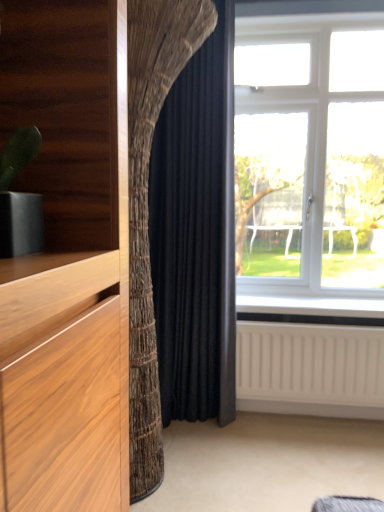
Question: Does black velvet curtain at center come in front of white plastic window at right?

Choices:
 (A) no
 (B) yes

Answer: (B)

Question: Considering the relative sizes of black velvet curtain at center and white plastic window at right in the image provided, is black velvet curtain at center taller than white plastic window at right?

Choices:
 (A) no
 (B) yes

Answer: (B)

Question: Is black velvet curtain at center further to the viewer compared to white plastic window at right?

Choices:
 (A) yes
 (B) no

Answer: (B)

Question: From a real-world perspective, is black velvet curtain at center positioned over white plastic window at right based on gravity?

Choices:
 (A) no
 (B) yes

Answer: (A)

Question: Does black velvet curtain at center appear on the right side of white plastic window at right?

Choices:
 (A) yes
 (B) no

Answer: (B)

Question: Is black velvet curtain at center bigger or smaller than white textured radiator at lower right?

Choices:
 (A) big
 (B) small

Answer: (A)

Question: Based on their positions, is black velvet curtain at center located to the left or right of white textured radiator at lower right?

Choices:
 (A) left
 (B) right

Answer: (A)

Question: Looking at their shapes, would you say black velvet curtain at center is wider or thinner than white textured radiator at lower right?

Choices:
 (A) wide
 (B) thin

Answer: (A)

Question: From their relative heights in the image, would you say black velvet curtain at center is taller or shorter than white textured radiator at lower right?

Choices:
 (A) tall
 (B) short

Answer: (A)

Question: Considering the relative positions of white plastic window at right and white textured radiator at lower right in the image provided, is white plastic window at right to the left or to the right of white textured radiator at lower right?

Choices:
 (A) right
 (B) left

Answer: (A)

Question: From a real-world perspective, is white plastic window at right above or below white textured radiator at lower right?

Choices:
 (A) below
 (B) above

Answer: (B)

Question: From their relative heights in the image, would you say white plastic window at right is taller or shorter than white textured radiator at lower right?

Choices:
 (A) tall
 (B) short

Answer: (A)

Question: Considering the positions of white plastic window at right and white textured radiator at lower right in the image, is white plastic window at right wider or thinner than white textured radiator at lower right?

Choices:
 (A) wide
 (B) thin

Answer: (A)

Question: Considering the positions of black velvet curtain at center and white plastic window at right in the image, is black velvet curtain at center wider or thinner than white plastic window at right?

Choices:
 (A) wide
 (B) thin

Answer: (B)

Question: Considering their positions, is black velvet curtain at center located in front of or behind white plastic window at right?

Choices:
 (A) behind
 (B) front

Answer: (B)